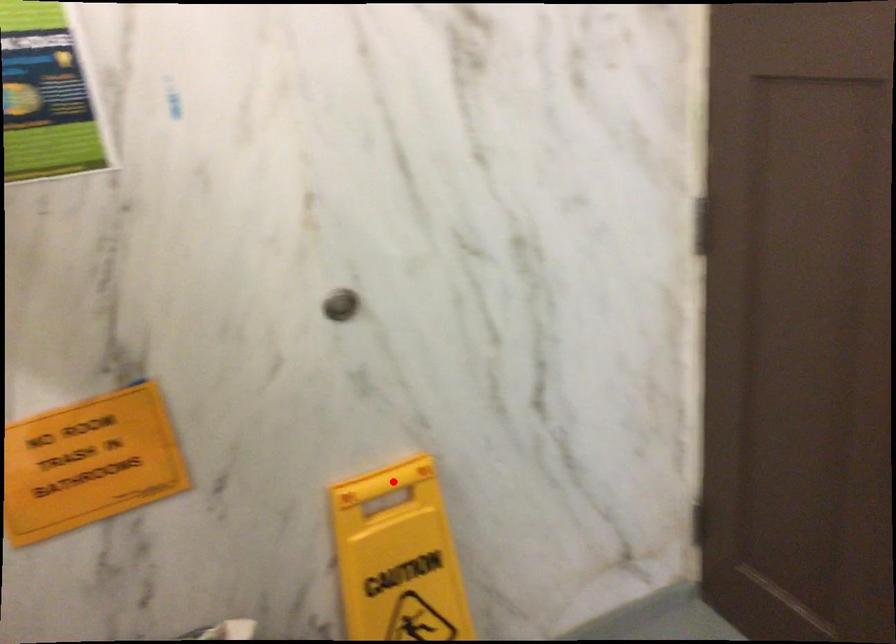
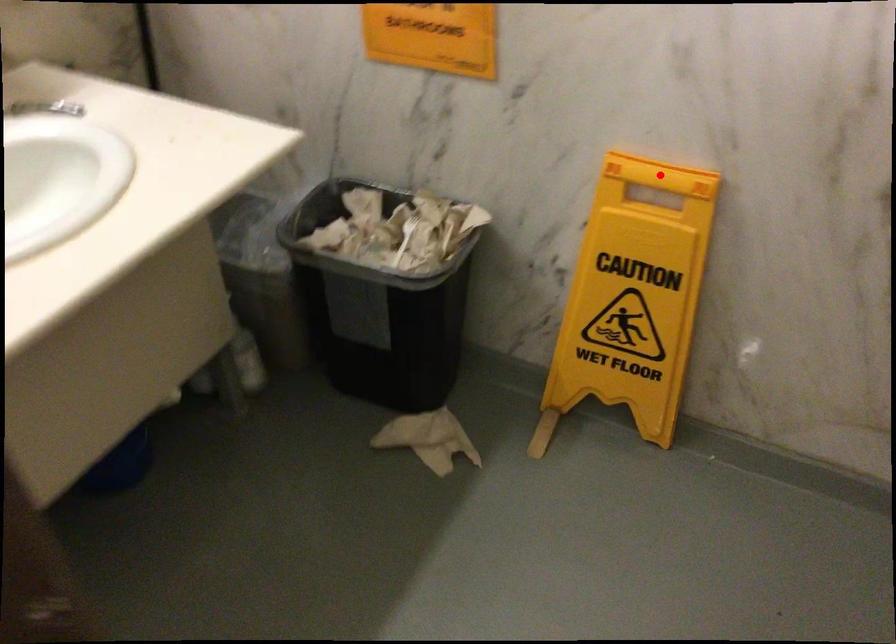
I am providing you with two images of the same scene from different viewpoints. A red point is marked on the first image and another point is marked on the second image. Are the points marked in image1 and image2 representing the same 3D position?

Yes